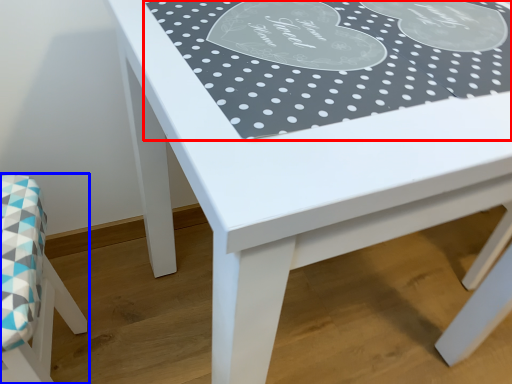
Question: Which object appears closest to the camera in this image, tablecloth (highlighted by a red box) or chair (highlighted by a blue box)?

Choices:
 (A) tablecloth
 (B) chair

Answer: (A)